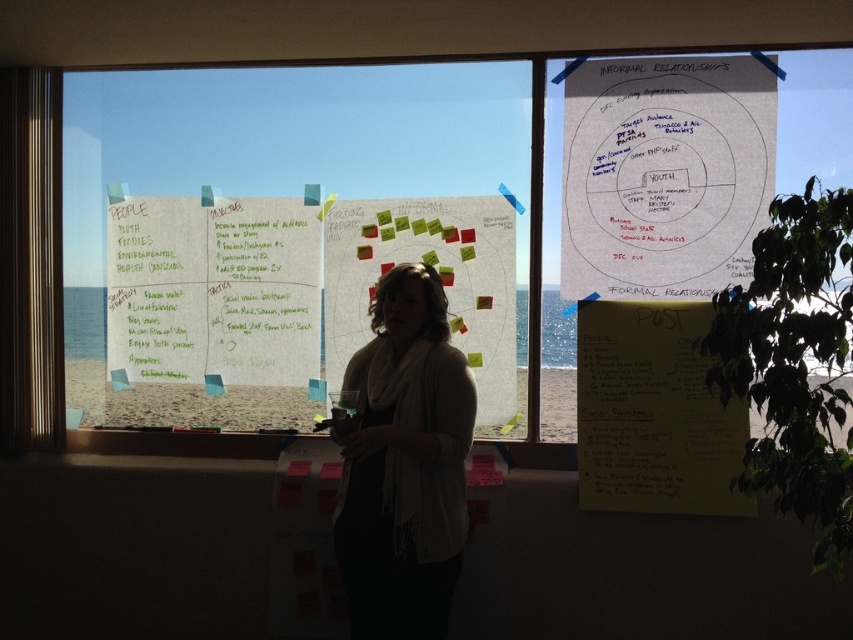
Can you confirm if green paperboard at center is positioned to the right of white paper at center?

In fact, green paperboard at center is to the left of white paper at center.

Does green paperboard at center have a larger size compared to white paper at center?

Yes.

Image resolution: width=853 pixels, height=640 pixels. Describe the element at coordinates (300, 285) in the screenshot. I see `green paperboard at center` at that location.

Where is `green paperboard at center`? This screenshot has height=640, width=853. green paperboard at center is located at coordinates (300, 285).

Is transparent glass window at center taller than white paper at upper right?

Yes.

Consider the image. Is transparent glass window at center positioned at the back of white paper at upper right?

Yes, it is.

Which is behind, point (206, 140) or point (698, 76)?

Positioned behind is point (206, 140).

Where is `transparent glass window at center`? transparent glass window at center is located at coordinates (274, 144).

Is white matte scarf at center further to camera compared to white paper with sticky notes at center?

No, white matte scarf at center is in front of white paper with sticky notes at center.

Is white matte scarf at center to the right of white paper with sticky notes at center from the viewer's perspective?

In fact, white matte scarf at center is to the left of white paper with sticky notes at center.

In order to click on white matte scarf at center in this screenshot , I will do `click(403, 464)`.